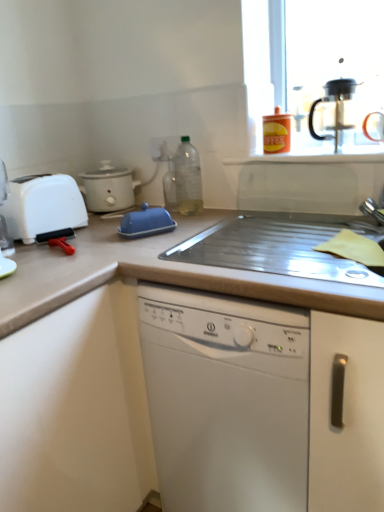
I want to click on free space in front of blue plastic butter dish at center, placed as the 2th kitchen appliance when sorted from right to left, so click(135, 247).